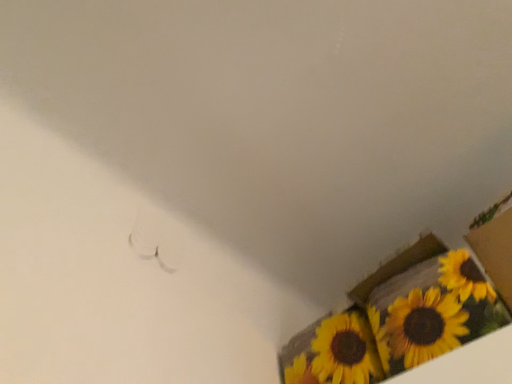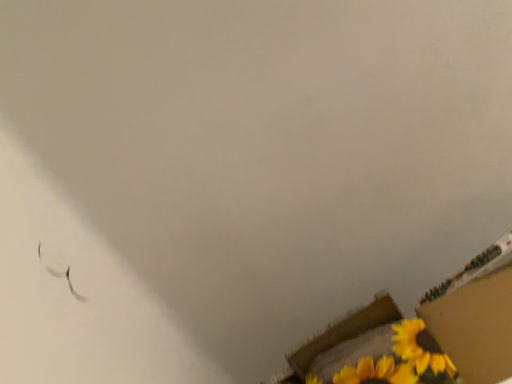
Question: How did the camera likely rotate when shooting the video?

Choices:
 (A) rotated left
 (B) rotated right

Answer: (B)